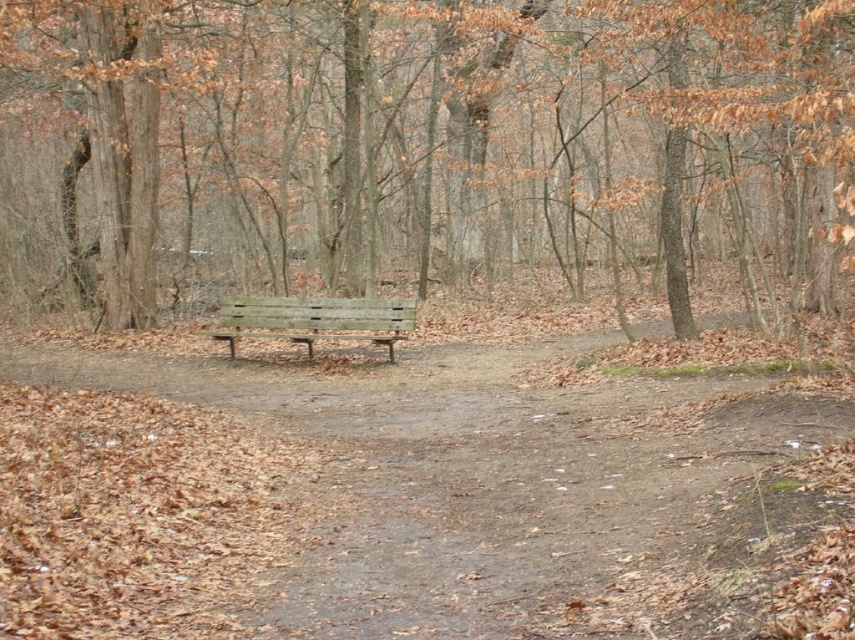
You are standing at the point with coordinates (429, 141) in the forest. What object is located exactly at your current position?

The brown wood bench at center is located exactly at the point with coordinates (429, 141).

You are standing at the weathered wood bench at center in the forest. You want to walk to the brown dirt path at center. In which direction should you move relative to the bench?

The brown dirt path at center is to the right of the weathered wood bench at center, so you should move to the right of the bench to reach the path.

You are standing at the entrance of the forest and see the brown wood bench at center. If you want to walk directly towards the bench, which direction should you head?

Since the brown wood bench at center is located at point 0.222 on the x and 0.503 on the y, you should head towards the left and center area to reach it.